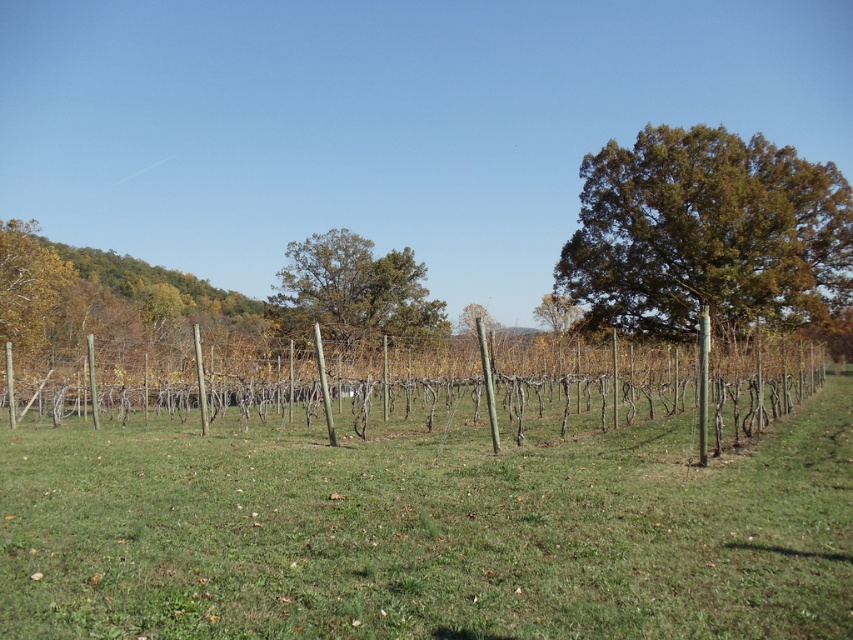
Question: Does green leafy tree at left appear over green matte tree at center?

Choices:
 (A) no
 (B) yes

Answer: (B)

Question: Which point is closer to the camera taking this photo?

Choices:
 (A) (459, 317)
 (B) (577, 307)
 (C) (332, 316)

Answer: (C)

Question: Can you confirm if wooden posts at center is thinner than brown textured tree at upper right?

Choices:
 (A) no
 (B) yes

Answer: (A)

Question: Among these objects, which one is farthest from the camera?

Choices:
 (A) green grass at center
 (B) brown rough tree at center
 (C) green matte tree at center

Answer: (B)

Question: Which of the following is the farthest from the observer?

Choices:
 (A) wooden posts at center
 (B) green grass at center
 (C) brown textured tree at upper right

Answer: (C)

Question: Can you confirm if green grass at center is bigger than brown rough tree at center?

Choices:
 (A) no
 (B) yes

Answer: (A)